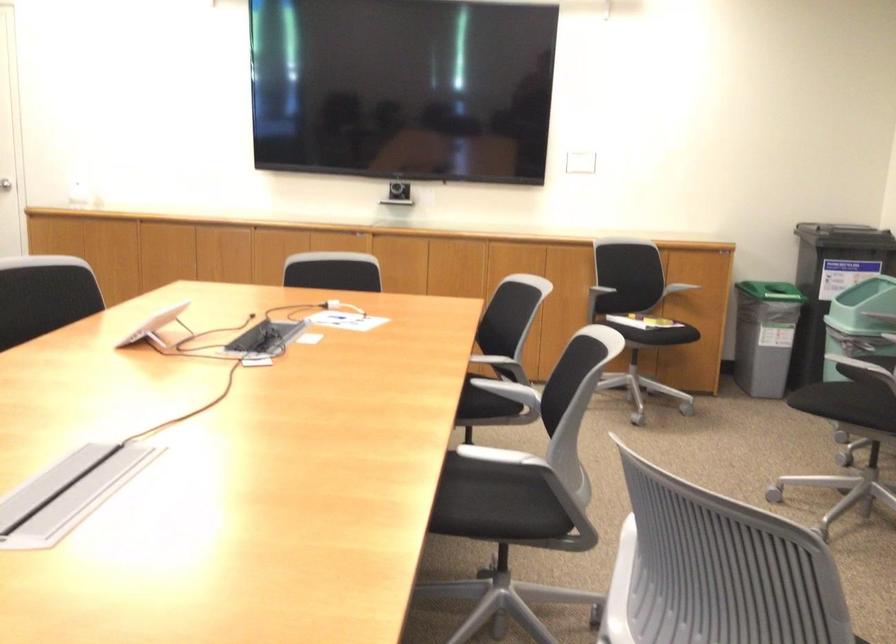
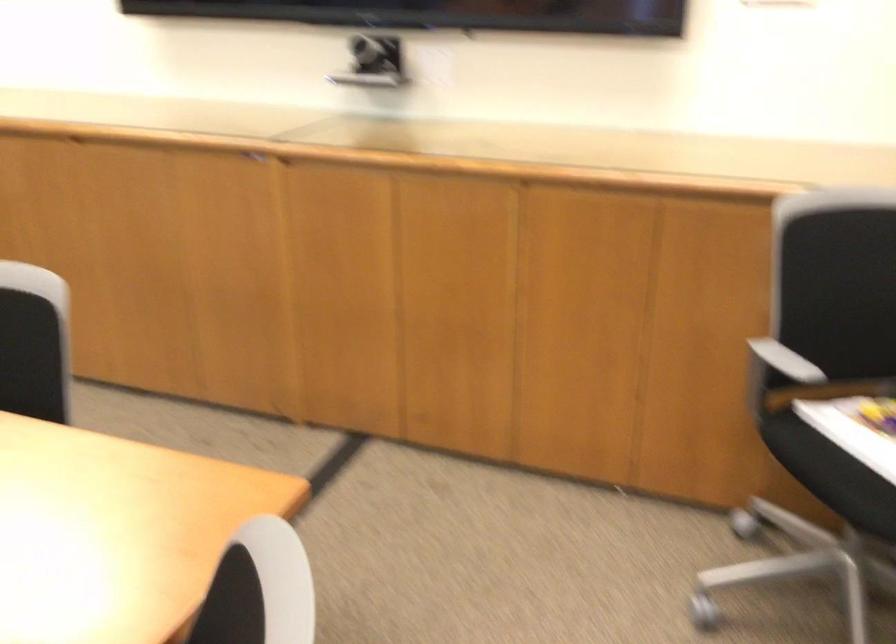
Question: What movement of the cameraman would produce the second image?

Choices:
 (A) Left
 (B) Right
 (C) Forward
 (D) Backward

Answer: (C)